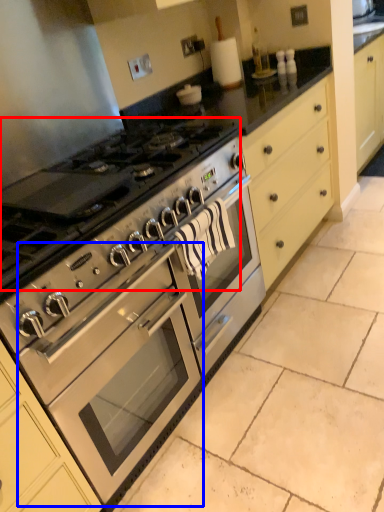
Question: Which object appears closest to the camera in this image, gas stove (highlighted by a red box) or oven (highlighted by a blue box)?

Choices:
 (A) gas stove
 (B) oven

Answer: (A)